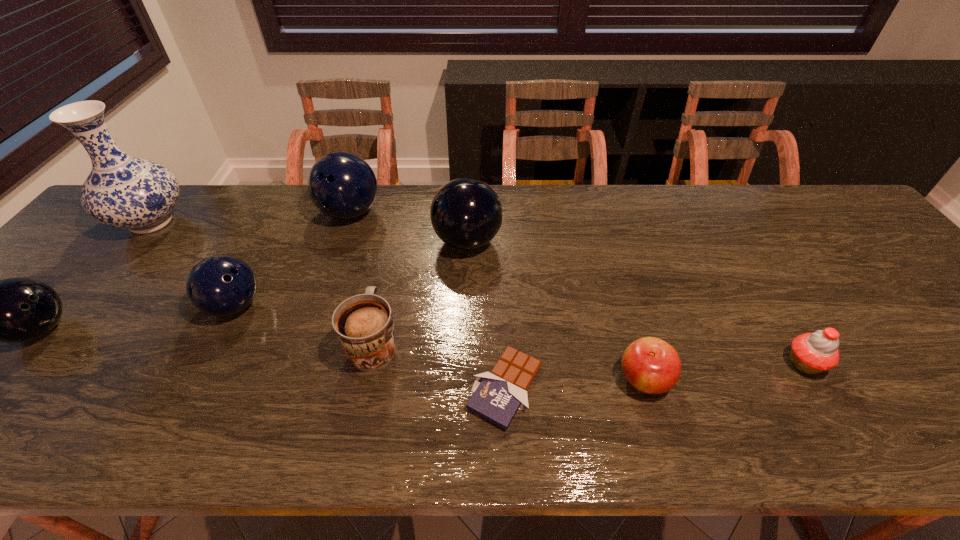
Where is `cupcake`? Image resolution: width=960 pixels, height=540 pixels. cupcake is located at coordinates (812, 353).

Locate an element on the screen. apple is located at coordinates (651, 365).

Locate an element on the screen. chocolate bar is located at coordinates (498, 395).

Image resolution: width=960 pixels, height=540 pixels. I want to click on free space located 0.240m on the right of the vase, so click(272, 222).

Identify the location of vacant space located 0.380m on the surface of the farther blue bowling ball near the finger holes. (307, 342).

At what (x,y) coordinates should I click in order to perform the action: click on vacant space located on the side of the right black bowling ball with the finger holes. Please return your answer as a coordinate pair (x, y). The height and width of the screenshot is (540, 960). Looking at the image, I should click on (630, 241).

Identify the location of vacant region located on the surface of the nearer blue bowling ball near the finger holes. The height and width of the screenshot is (540, 960). (322, 306).

This screenshot has height=540, width=960. Identify the location of vacant space situated 0.330m on the side of the mug with the handle. (x=398, y=226).

Where is `free space located 0.310m on the side of the mug with the handle`? free space located 0.310m on the side of the mug with the handle is located at coordinates (397, 230).

Identify the location of vacant point located on the side of the mug with the handle. The width and height of the screenshot is (960, 540). (396, 239).